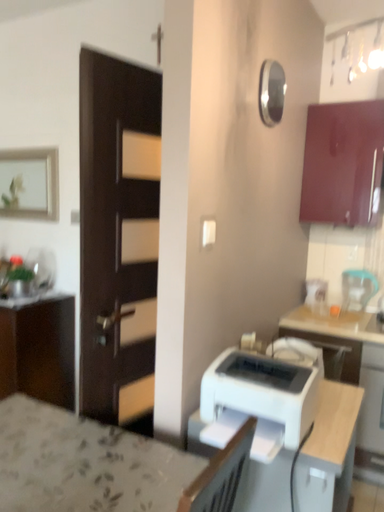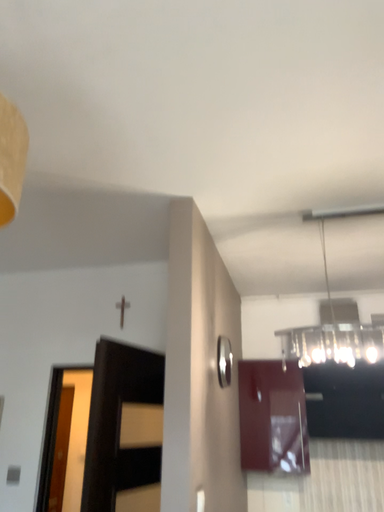
Question: How did the camera likely rotate when shooting the video?

Choices:
 (A) rotated left
 (B) rotated right

Answer: (B)